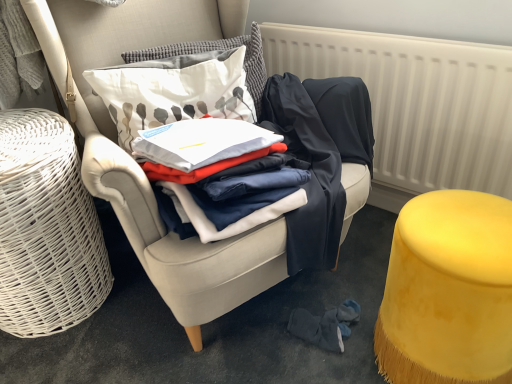
Describe the element at coordinates (46, 229) in the screenshot. This screenshot has width=512, height=384. I see `white wicker basket at left` at that location.

Measure the distance between point (76,221) and camera.

The distance of point (76,221) from camera is 1.20 meters.

What is the approximate width of velvet armchair at center?

velvet armchair at center is 36.93 inches in width.

Where is `white textured radiator at upper right`? white textured radiator at upper right is located at coordinates (416, 102).

Identify the location of white printed cushion at upper center, the 2th pillow when ordered from top to bottom. The image size is (512, 384). (173, 91).

From a real-world perspective, is white cotton pillow at upper center, arranged as the first pillow when viewed from the top, under velvet armchair at center?

Actually, white cotton pillow at upper center, arranged as the first pillow when viewed from the top, is physically above velvet armchair at center in the real world.

From the image's perspective, between white cotton pillow at upper center, which ranks as the second pillow in bottom-to-top order, and velvet armchair at center, who is located below?

velvet armchair at center is shown below in the image.

Which object is further away from the camera taking this photo, white cotton pillow at upper center, arranged as the first pillow when viewed from the top, or velvet armchair at center?

white cotton pillow at upper center, arranged as the first pillow when viewed from the top, is further away from the camera.

Which of these two, velvet armchair at center or white wicker basket at left, is wider?

velvet armchair at center.

From their relative heights in the image, would you say velvet armchair at center is taller or shorter than white wicker basket at left?

In the image, velvet armchair at center appears to be taller than white wicker basket at left.

Is velvet armchair at center inside the boundaries of white wicker basket at left, or outside?

velvet armchair at center is not enclosed by white wicker basket at left.

From the image's perspective, which one is positioned higher, velvet armchair at center or white wicker basket at left?

velvet armchair at center, from the image's perspective.

Is white printed cushion at upper center, the 2th pillow when ordered from top to bottom, surrounding white textured radiator at upper right?

No.

Is white printed cushion at upper center, positioned as the 1th pillow in bottom-to-top order, wider than white textured radiator at upper right?

Indeed, white printed cushion at upper center, positioned as the 1th pillow in bottom-to-top order, has a greater width compared to white textured radiator at upper right.

In the scene shown: From a real-world perspective, between white printed cushion at upper center, positioned as the 1th pillow in bottom-to-top order, and white textured radiator at upper right, who is vertically lower?

white textured radiator at upper right is physically lower.

Is velvet yellow stool at lower right with white cotton shirt at center?

They are not placed beside each other.

Which is behind, velvet yellow stool at lower right or white cotton shirt at center?

white cotton shirt at center is more distant.

From the image's perspective, between velvet yellow stool at lower right and white cotton shirt at center, which one is located above?

From the image's view, white cotton shirt at center is above.

Identify the location of clothing below the white cotton pillow at upper center, arranged as the first pillow when viewed from the top (from the image's perspective). The image size is (512, 384). (220, 170).

Is white cotton pillow at upper center, which ranks as the second pillow in bottom-to-top order, located outside white cotton shirt at center?

Indeed, white cotton pillow at upper center, which ranks as the second pillow in bottom-to-top order, is completely outside white cotton shirt at center.

Who is more distant, white cotton pillow at upper center, which ranks as the second pillow in bottom-to-top order, or white cotton shirt at center?

white cotton pillow at upper center, which ranks as the second pillow in bottom-to-top order, is more distant.

From a real-world perspective, between white cotton pillow at upper center, which ranks as the second pillow in bottom-to-top order, and white cotton shirt at center, who is vertically higher?

In real-world perspective, white cotton pillow at upper center, which ranks as the second pillow in bottom-to-top order, is above.

Can you confirm if white textured radiator at upper right is positioned to the left of velvet yellow stool at lower right?

Yes.

From a real-world perspective, is white textured radiator at upper right physically located above or below velvet yellow stool at lower right?

white textured radiator at upper right is situated higher than velvet yellow stool at lower right in the real world.

Between white textured radiator at upper right and velvet yellow stool at lower right, which one has larger width?

velvet yellow stool at lower right is wider.

Is point (25, 186) closer or farther from the camera than point (248, 75)?

Point (25, 186) appears to be closer to the viewer than point (248, 75).

Looking at this image, is white wicker basket at left bigger or smaller than white cotton pillow at upper center, which ranks as the second pillow in bottom-to-top order?

In the image, white wicker basket at left appears to be larger than white cotton pillow at upper center, which ranks as the second pillow in bottom-to-top order.

From the image's perspective, which is below, white wicker basket at left or white cotton pillow at upper center, arranged as the first pillow when viewed from the top?

From the image's view, white wicker basket at left is below.

Locate an element on the screen. This screenshot has height=384, width=512. chair that appears below the white cotton pillow at upper center, arranged as the first pillow when viewed from the top (from a real-world perspective) is located at coordinates (140, 168).

Locate an element on the screen. This screenshot has height=384, width=512. furniture behind the velvet armchair at center is located at coordinates (46, 229).

Which object lies nearer to the anchor point velvet armchair at center, velvet yellow stool at lower right or white printed cushion at upper center, the 2th pillow when ordered from top to bottom?

Among the two, white printed cushion at upper center, the 2th pillow when ordered from top to bottom, is located nearer to velvet armchair at center.

When comparing their distances from white wicker basket at left, does velvet yellow stool at lower right or white cotton pillow at upper center, arranged as the first pillow when viewed from the top, seem closer?

white cotton pillow at upper center, arranged as the first pillow when viewed from the top, lies closer to white wicker basket at left than the other object.

In the scene shown: When comparing their distances from velvet yellow stool at lower right, does white textured radiator at upper right or velvet armchair at center seem further?

The object further to velvet yellow stool at lower right is white textured radiator at upper right.

Estimate the real-world distances between objects in this image. Which object is closer to white textured radiator at upper right, white cotton pillow at upper center, arranged as the first pillow when viewed from the top, or white printed cushion at upper center, the 2th pillow when ordered from top to bottom?

Based on the image, white cotton pillow at upper center, arranged as the first pillow when viewed from the top, appears to be nearer to white textured radiator at upper right.

When comparing their distances from velvet yellow stool at lower right, does velvet armchair at center or white wicker basket at left seem closer?

The object closer to velvet yellow stool at lower right is velvet armchair at center.

Estimate the real-world distances between objects in this image. Which object is closer to velvet armchair at center, white wicker basket at left or white cotton pillow at upper center, which ranks as the second pillow in bottom-to-top order?

white wicker basket at left lies closer to velvet armchair at center than the other object.

Considering their positions, is white cotton pillow at upper center, arranged as the first pillow when viewed from the top, positioned closer to white printed cushion at upper center, positioned as the 1th pillow in bottom-to-top order, than velvet yellow stool at lower right?

white cotton pillow at upper center, arranged as the first pillow when viewed from the top.

From the image, which object appears to be farther from velvet armchair at center, white textured radiator at upper right or white wicker basket at left?

white textured radiator at upper right is further to velvet armchair at center.

Identify the location of pillow between velvet armchair at center and white cotton pillow at upper center, which ranks as the second pillow in bottom-to-top order, along the z-axis. The image size is (512, 384). click(x=173, y=91).

At what (x,y) coordinates should I click in order to perform the action: click on radiator between velvet armchair at center and velvet yellow stool at lower right from left to right. Please return your answer as a coordinate pair (x, y). Looking at the image, I should click on (416, 102).

Image resolution: width=512 pixels, height=384 pixels. I want to click on stool located between velvet armchair at center and white cotton pillow at upper center, which ranks as the second pillow in bottom-to-top order, in the depth direction, so click(448, 291).

This screenshot has width=512, height=384. I want to click on clothing situated between white printed cushion at upper center, the 2th pillow when ordered from top to bottom, and velvet yellow stool at lower right from left to right, so click(220, 170).